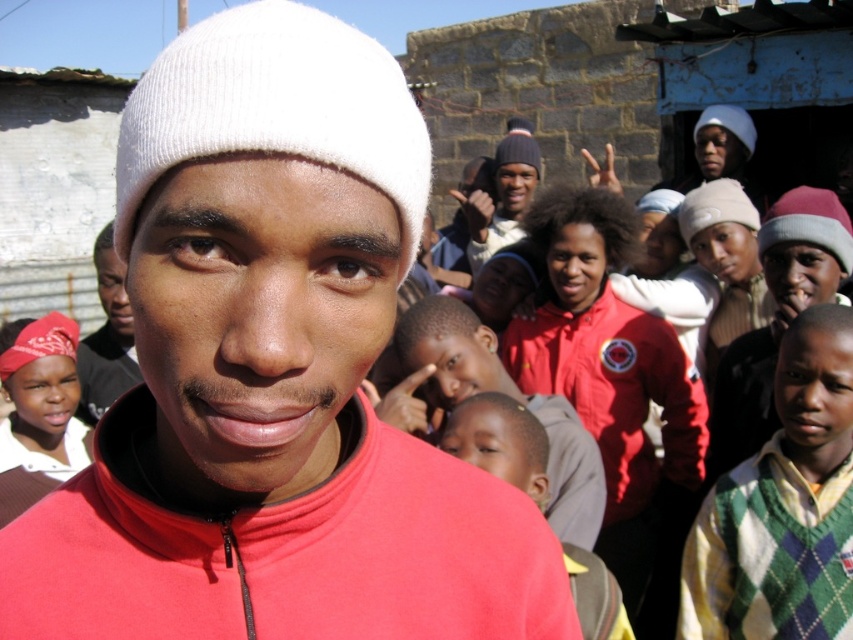
In the scene, there are two items of clothing or accessories visible. The first is the green argyle sweater at right, and the second is the matte red bandana at lower left. Which of these two items is positioned lower in the image?

The green argyle sweater at right is positioned below the matte red bandana at lower left, so the green argyle sweater at right is lower in the image.

You are a photographer trying to capture a photo of the smooth skin child at center and the knitted gray beanie at center. Which object is positioned lower in the image?

The smooth skin child at center is located below the knitted gray beanie at center, so the smooth skin child at center is positioned lower in the image.